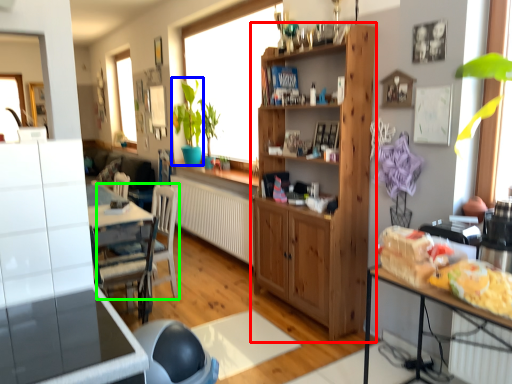
Question: Which object is the closest to the cabinetry (highlighted by a red box)? Choose among these: plant (highlighted by a blue box) or chair (highlighted by a green box).

Choices:
 (A) plant
 (B) chair

Answer: (B)